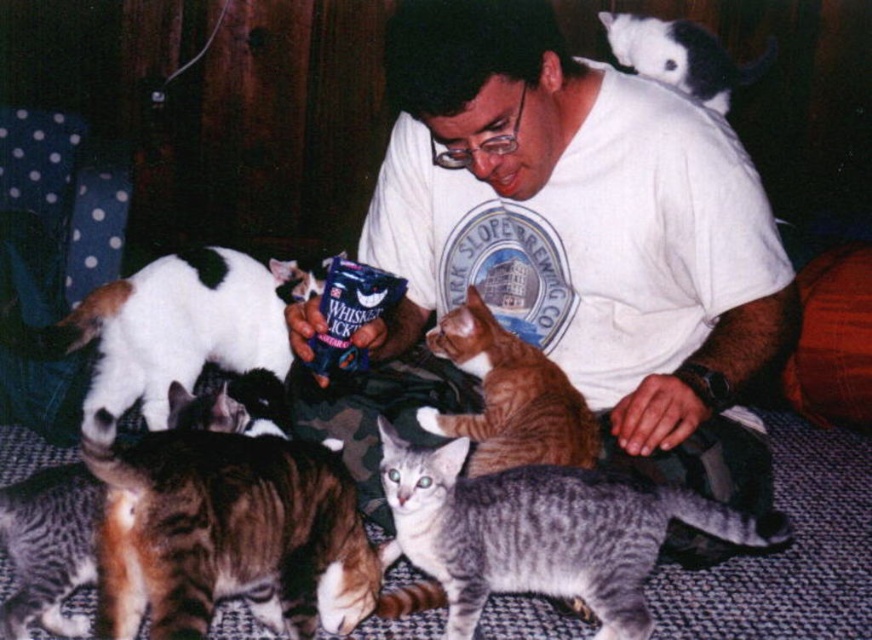
Question: Which object appears farthest from the camera in this image?

Choices:
 (A) orange tabby cat at center
 (B) white and black fur cat at upper right
 (C) white t-shirt at center
 (D) white fur cat at left

Answer: (B)

Question: Which object is positioned farthest from the white t-shirt at center?

Choices:
 (A) gray striped cat at lower center
 (B) white fur cat at left
 (C) orange tabby cat at center

Answer: (B)

Question: Can you confirm if gray striped cat at lower center is bigger than white fur cat at left?

Choices:
 (A) yes
 (B) no

Answer: (B)

Question: Does white t-shirt at center appear under white fur cat at left?

Choices:
 (A) yes
 (B) no

Answer: (A)

Question: Among these points, which one is nearest to the camera?

Choices:
 (A) (481, 241)
 (B) (556, 396)

Answer: (B)

Question: Is gray striped cat at lower center in front of white fur cat at left?

Choices:
 (A) no
 (B) yes

Answer: (B)